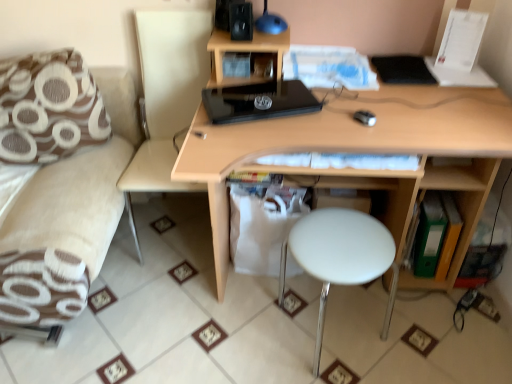
Question: From the image's perspective, is black matte speaker at upper center under light wood desk at center?

Choices:
 (A) yes
 (B) no

Answer: (B)

Question: Is black matte speaker at upper center located outside light wood desk at center?

Choices:
 (A) no
 (B) yes

Answer: (B)

Question: Are black matte speaker at upper center and light wood desk at center beside each other?

Choices:
 (A) no
 (B) yes

Answer: (A)

Question: Does black matte speaker at upper center have a lesser width compared to light wood desk at center?

Choices:
 (A) no
 (B) yes

Answer: (B)

Question: Would you say black matte speaker at upper center is a long distance from light wood desk at center?

Choices:
 (A) yes
 (B) no

Answer: (B)

Question: Considering the positions of black matte speaker at upper center and black glossy laptop at center in the image, is black matte speaker at upper center wider or thinner than black glossy laptop at center?

Choices:
 (A) thin
 (B) wide

Answer: (A)

Question: From a real-world perspective, is black matte speaker at upper center positioned above or below black glossy laptop at center?

Choices:
 (A) above
 (B) below

Answer: (A)

Question: In the image, is black matte speaker at upper center on the left side or the right side of black glossy laptop at center?

Choices:
 (A) right
 (B) left

Answer: (B)

Question: Choose the correct answer: Is black matte speaker at upper center inside black glossy laptop at center or outside it?

Choices:
 (A) inside
 (B) outside

Answer: (B)

Question: Is beige fabric swivel chair at left to the left or to the right of brown fabric pillow at left in the image?

Choices:
 (A) left
 (B) right

Answer: (B)

Question: Is point (178, 26) positioned closer to the camera than point (93, 114)?

Choices:
 (A) farther
 (B) closer

Answer: (A)

Question: In terms of size, does beige fabric swivel chair at left appear bigger or smaller than brown fabric pillow at left?

Choices:
 (A) small
 (B) big

Answer: (B)

Question: Considering the positions of beige fabric swivel chair at left and brown fabric pillow at left in the image, is beige fabric swivel chair at left wider or thinner than brown fabric pillow at left?

Choices:
 (A) wide
 (B) thin

Answer: (A)

Question: From their relative heights in the image, would you say black glossy laptop at center is taller or shorter than black matte speaker at upper center?

Choices:
 (A) short
 (B) tall

Answer: (A)

Question: In the image, is black glossy laptop at center positioned in front of or behind black matte speaker at upper center?

Choices:
 (A) front
 (B) behind

Answer: (A)